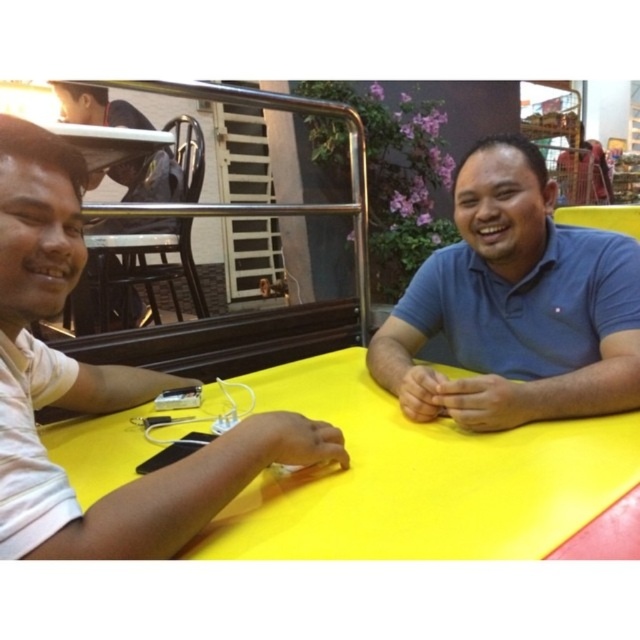
You are sitting at the yellow table and want to reach both the point at coordinates (x=577, y=525) and the point at coordinates (x=138, y=118). Which point is closer to you?

Point (x=577, y=525) is in front of point (x=138, y=118), so it is closer to you.

You are standing in a room and see the yellow matte table at center and the white matte shirt at left. Which object is positioned more to the right side of the room?

The yellow matte table at center is positioned more to the right side of the room compared to the white matte shirt at left.

You are a delivery person who needs to place a package on the yellow matte table at center. The package requires 1.5 meters of space between it and the matte black shirt at upper left to avoid blocking the view. Can you safely place the package on the table?

The yellow matte table at center is 1.47 meters from the matte black shirt at upper left. Since the required space is 1.5 meters, placing the package would not meet the requirement, so it cannot be safely placed there.